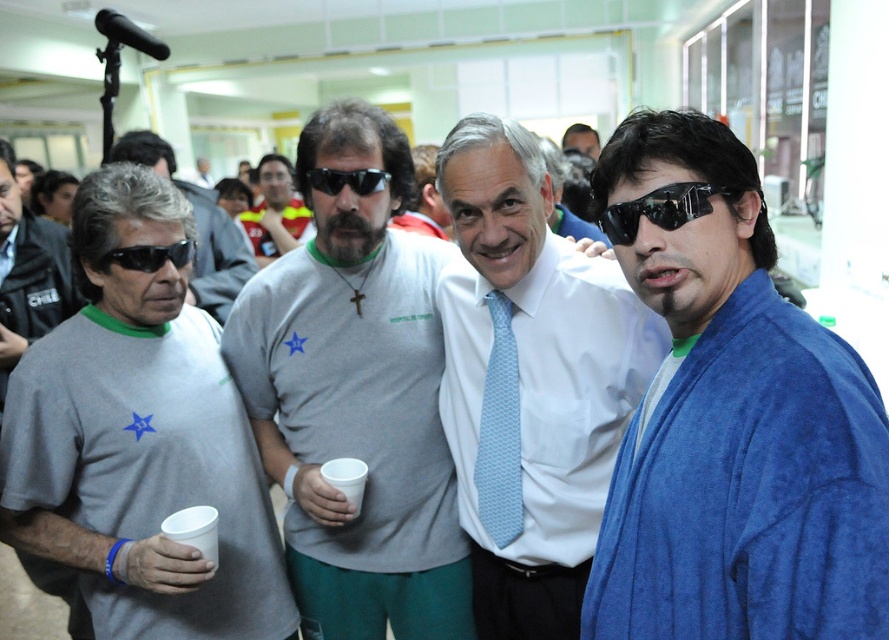
You are trying to determine if the blue plush robe at right can fit through a doorway that is the same width as the black plastic sunglasses at center. Can it fit?

The blue plush robe at right might be wider than black plastic sunglasses at center, so it might not fit through the doorway if the robe is wider than the sunglasses.

You are a security guard in the building and need to check the height of the blue plush robe at right and the black plastic sunglasses at center. Which object is taller?

The blue plush robe at right is taller than the black plastic sunglasses at center.